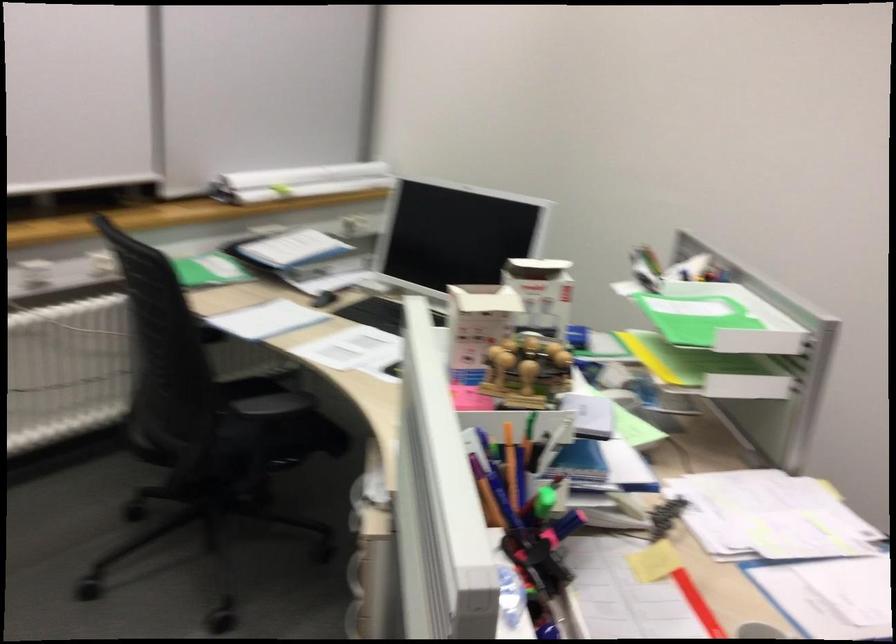
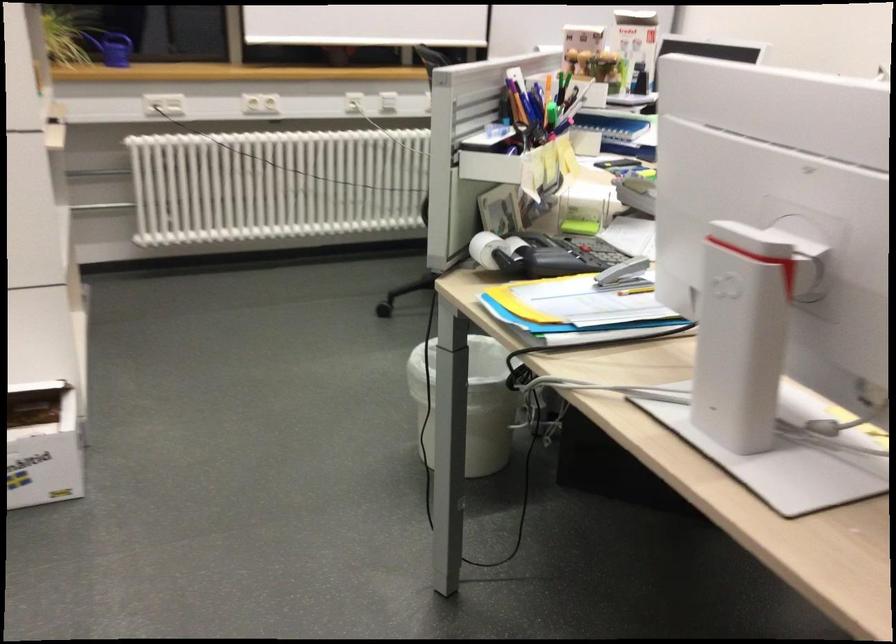
Where in the second image is the point corresponding to (x=470, y=497) from the first image?

(521, 104)